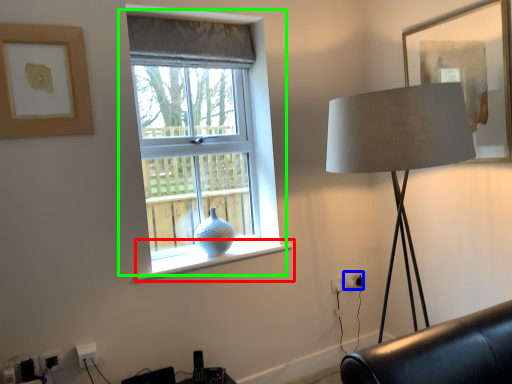
Question: Which object is positioned farthest from window sill (highlighted by a red box)? Select from electric outlet (highlighted by a blue box) and window (highlighted by a green box).

Choices:
 (A) electric outlet
 (B) window

Answer: (A)